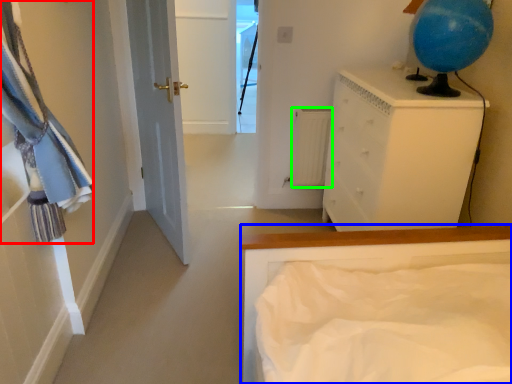
Question: Considering the real-world distances, which object is farthest from laundry (highlighted by a red box)? bed (highlighted by a blue box) or radiator (highlighted by a green box)?

Choices:
 (A) bed
 (B) radiator

Answer: (B)